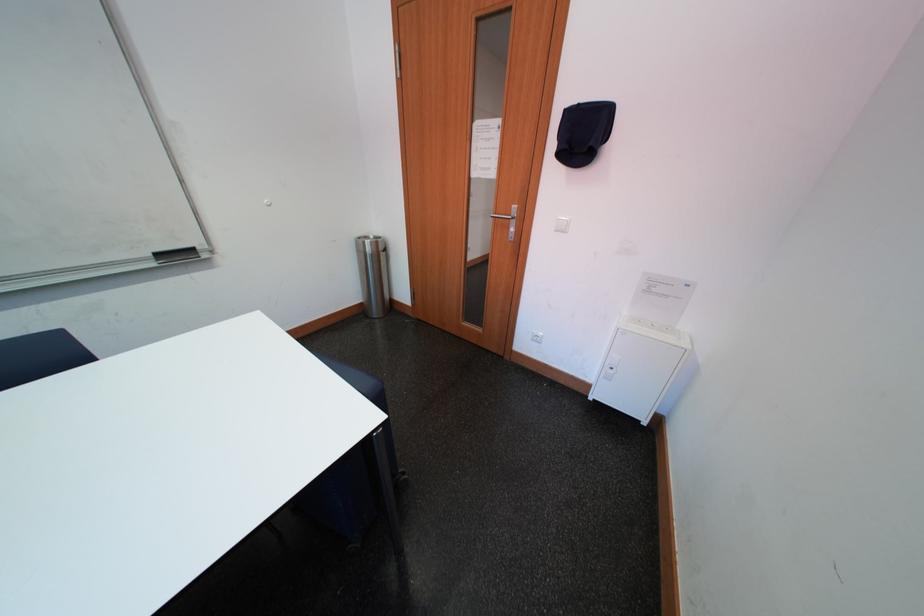
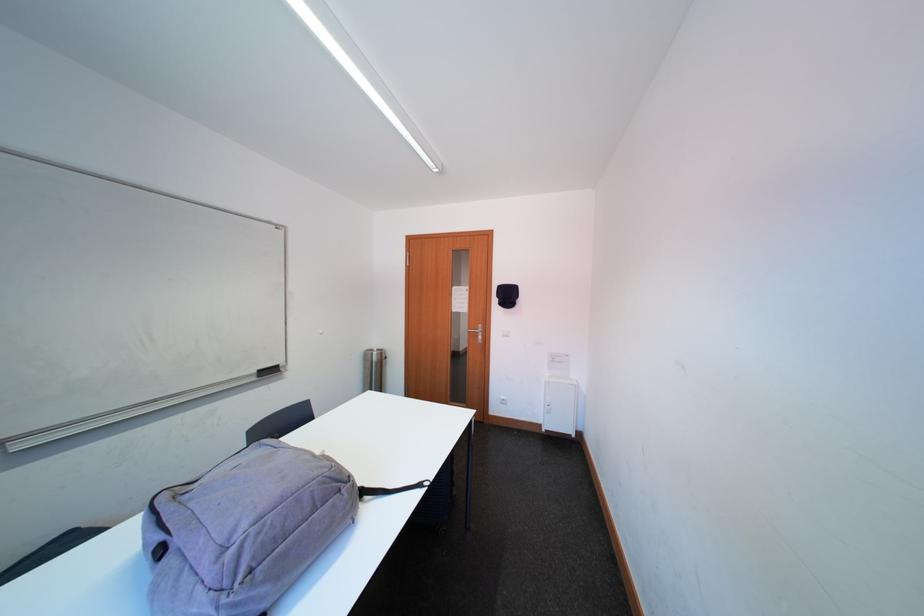
Where in the second image is the point corresponding to the point at 599,390 from the first image?

(551, 429)